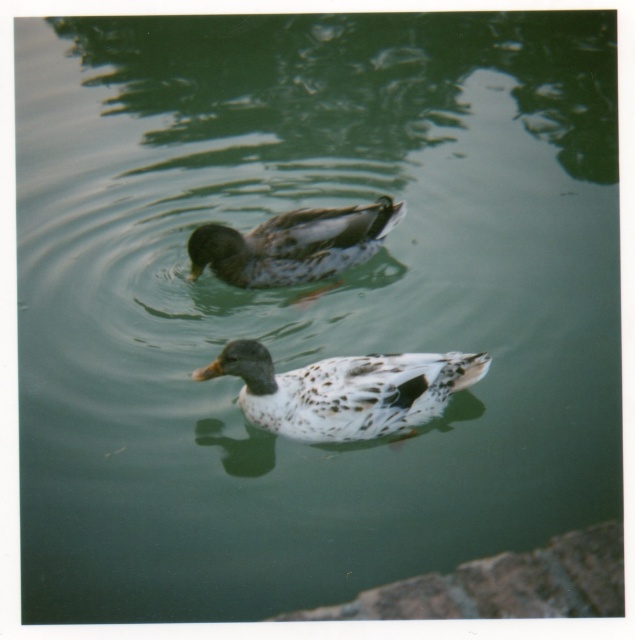
Which of these two, speckled feathered duck at center or speckled brown duck at center, stands taller?

speckled brown duck at center is taller.

Which is in front, point (389, 365) or point (311, 298)?

Point (389, 365) is in front.

Locate an element on the screen. speckled feathered duck at center is located at coordinates (344, 392).